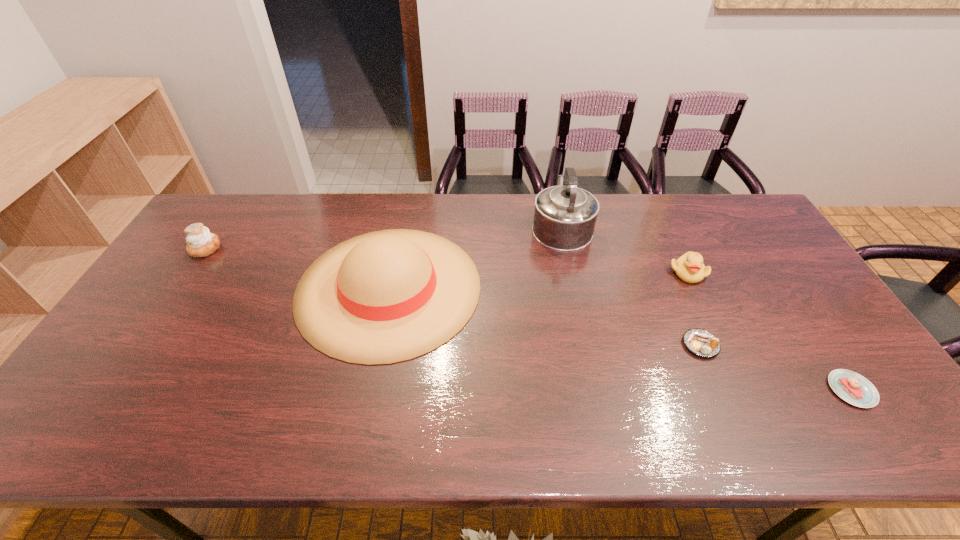
Image resolution: width=960 pixels, height=540 pixels. What are the coordinates of `the tallest object` in the screenshot? It's located at (565, 216).

The width and height of the screenshot is (960, 540). I want to click on kettle, so click(x=565, y=216).

This screenshot has height=540, width=960. I want to click on the fifth shortest object, so click(386, 296).

You are a GUI agent. You are given a task and a screenshot of the screen. Output one action in this format:
    pyautogui.click(x=<x>, y=<y>)
    Task: Click on the fifth object from right to left
    
    Given the screenshot: What is the action you would take?
    [386, 296]

This screenshot has width=960, height=540. In order to click on the tallest pastry in this screenshot , I will do `click(200, 242)`.

The width and height of the screenshot is (960, 540). I want to click on the farthest pastry, so click(x=200, y=242).

Find the location of a particular element. This screenshot has height=540, width=960. duckling is located at coordinates (689, 267).

This screenshot has width=960, height=540. Find the location of `the second farthest pastry`. the second farthest pastry is located at coordinates (701, 342).

This screenshot has height=540, width=960. In order to click on the rightmost pastry in this screenshot , I will do `click(852, 387)`.

Where is `the nearest object`? the nearest object is located at coordinates (852, 387).